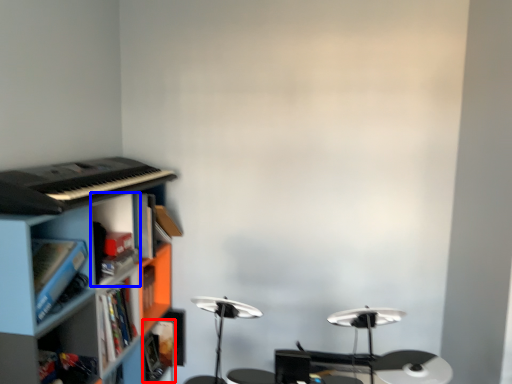
Question: Which of the following is the farthest to the observer, book (highlighted by a red box) or cabinet (highlighted by a blue box)?

Choices:
 (A) book
 (B) cabinet

Answer: (A)